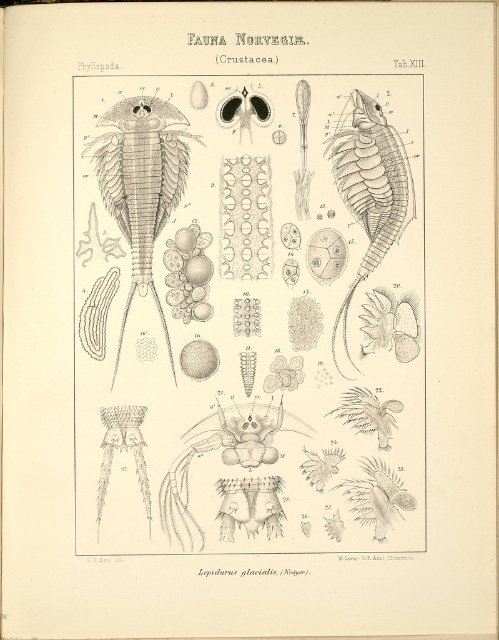
Who is more forward, (x=116, y=353) or (x=369, y=211)?

Point (x=116, y=353) is in front.

Who is positioned more to the left, grayish-brown crustacean at center-left or translucent gray crustacean at center-right?

From the viewer's perspective, grayish-brown crustacean at center-left appears more on the left side.

Does point (160, 145) come farther from viewer compared to point (394, 236)?

No, it is not.

Where is `grayish-brown crustacean at center-left`? grayish-brown crustacean at center-left is located at coordinates (142, 182).